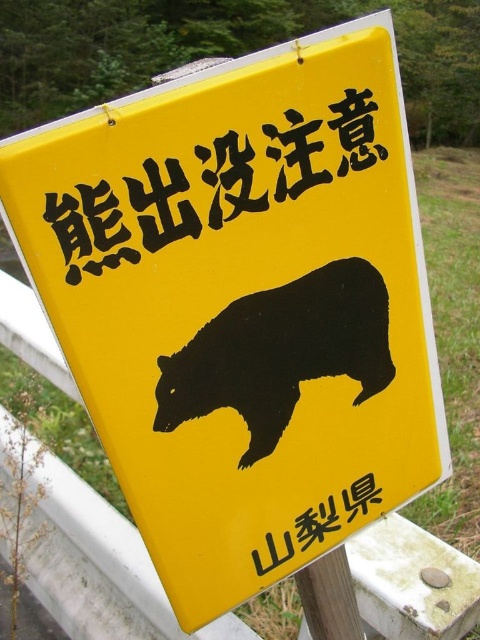
Where is `yellow paper at center`? yellow paper at center is located at coordinates (317, 525).

Who is positioned more to the left, yellow paper at center or wooden post at lower center?

Positioned to the left is yellow paper at center.

Who is more distant from viewer, (289, 525) or (336, 636)?

The point (336, 636) is behind.

This screenshot has width=480, height=640. What are the coordinates of `yellow paper at center` in the screenshot? It's located at (317, 525).

Is blackmaterial/texture at upper center bigger than wooden post at lower center?

Yes, blackmaterial/texture at upper center is bigger than wooden post at lower center.

What do you see at coordinates (204, 177) in the screenshot? The image size is (480, 640). I see `blackmaterial/texture at upper center` at bounding box center [204, 177].

Between point (251, 218) and point (307, 616), which one is positioned behind?

Positioned behind is point (307, 616).

The height and width of the screenshot is (640, 480). What are the coordinates of `blackmaterial/texture at upper center` in the screenshot? It's located at (204, 177).

Which is behind, point (340, 333) or point (305, 616)?

The point (305, 616) is more distant.

Between black silhouette bear at center and wooden post at lower center, which one appears on the right side from the viewer's perspective?

From the viewer's perspective, wooden post at lower center appears more on the right side.

Which is in front, point (248, 356) or point (313, 612)?

Positioned in front is point (248, 356).

Find the location of a particular element. Image resolution: width=480 pixels, height=640 pixels. black silhouette bear at center is located at coordinates (280, 353).